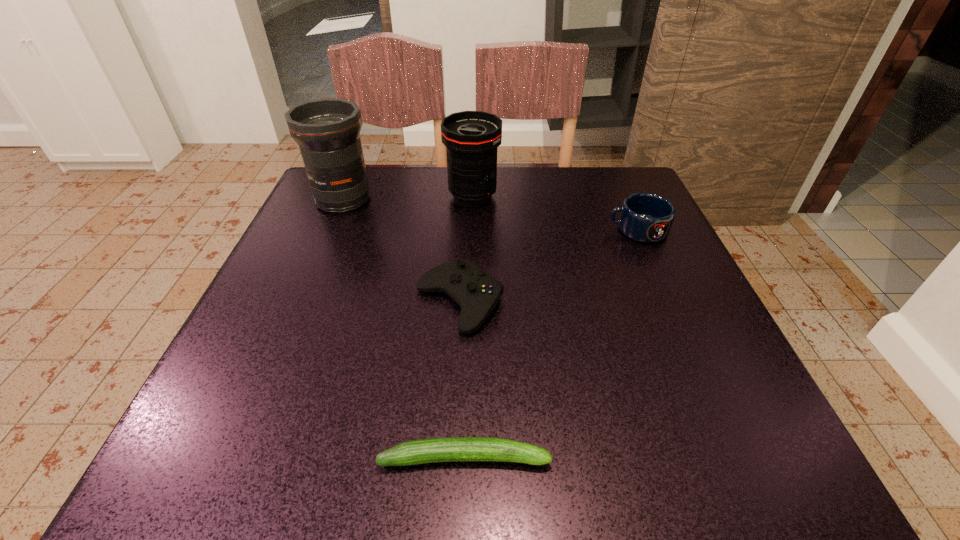
The width and height of the screenshot is (960, 540). What are the coordinates of `the left telephoto lens` in the screenshot? It's located at (327, 130).

Identify the location of the second tallest object. This screenshot has height=540, width=960. (471, 138).

At what (x,y) coordinates should I click in order to perform the action: click on the right telephoto lens. Please return your answer as a coordinate pair (x, y). Looking at the image, I should click on (471, 138).

At what (x,y) coordinates should I click in order to perform the action: click on the third tallest object. Please return your answer as a coordinate pair (x, y). Image resolution: width=960 pixels, height=540 pixels. Looking at the image, I should click on (645, 217).

Find the location of a particular element. This screenshot has width=960, height=540. the rightmost object is located at coordinates (645, 217).

Where is `the fourth tallest object`? This screenshot has height=540, width=960. the fourth tallest object is located at coordinates (477, 293).

I want to click on control, so (x=477, y=293).

The height and width of the screenshot is (540, 960). I want to click on the shortest object, so click(450, 449).

You are a GUI agent. You are given a task and a screenshot of the screen. Output one action in this format:
    pyautogui.click(x=<x>, y=<y>)
    Task: Click on the nearest object
    The width and height of the screenshot is (960, 540).
    Given the screenshot: What is the action you would take?
    pyautogui.click(x=450, y=449)

Where is `vacant space located 0.200m on the front of the leftmost object`? This screenshot has width=960, height=540. vacant space located 0.200m on the front of the leftmost object is located at coordinates (310, 276).